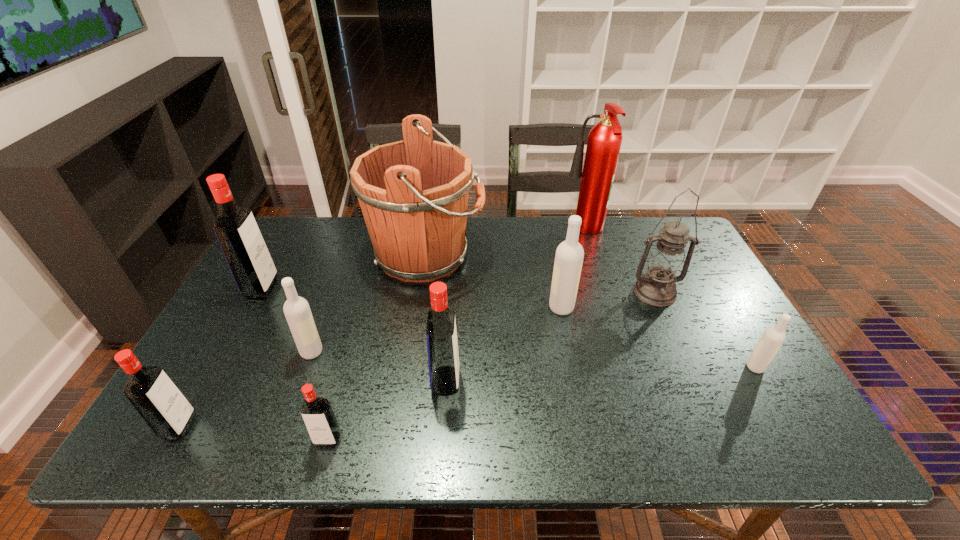
Locate an element on the screen. bucket present at the far edge is located at coordinates click(x=413, y=194).

Image resolution: width=960 pixels, height=540 pixels. I want to click on oil lamp present at the right edge, so click(x=666, y=264).

At what (x,y) coordinates should I click in order to perform the action: click on vodka that is positioned at the right edge. Please return your answer as a coordinate pair (x, y). Image resolution: width=960 pixels, height=540 pixels. Looking at the image, I should click on (773, 338).

Identify the location of object present at the near left corner. (156, 398).

Locate an element on the screen. This screenshot has width=960, height=540. free space at the far edge is located at coordinates (546, 230).

In the image, there is a desktop. Where is `vacant space at the near edge`? The height and width of the screenshot is (540, 960). vacant space at the near edge is located at coordinates (592, 422).

Image resolution: width=960 pixels, height=540 pixels. I want to click on vacant space at the left edge of the desktop, so click(228, 344).

You are a GUI agent. You are given a task and a screenshot of the screen. Output one action in this format:
    pyautogui.click(x=<x>, y=<y>)
    Task: Click on the free point at the right edge
    The width and height of the screenshot is (960, 540).
    Given the screenshot: What is the action you would take?
    pyautogui.click(x=709, y=287)

Where is `vacant point at the far left corner`? This screenshot has width=960, height=540. vacant point at the far left corner is located at coordinates (277, 254).

What are the coordinates of `free space at the near right corner of the desktop` in the screenshot? It's located at (801, 437).